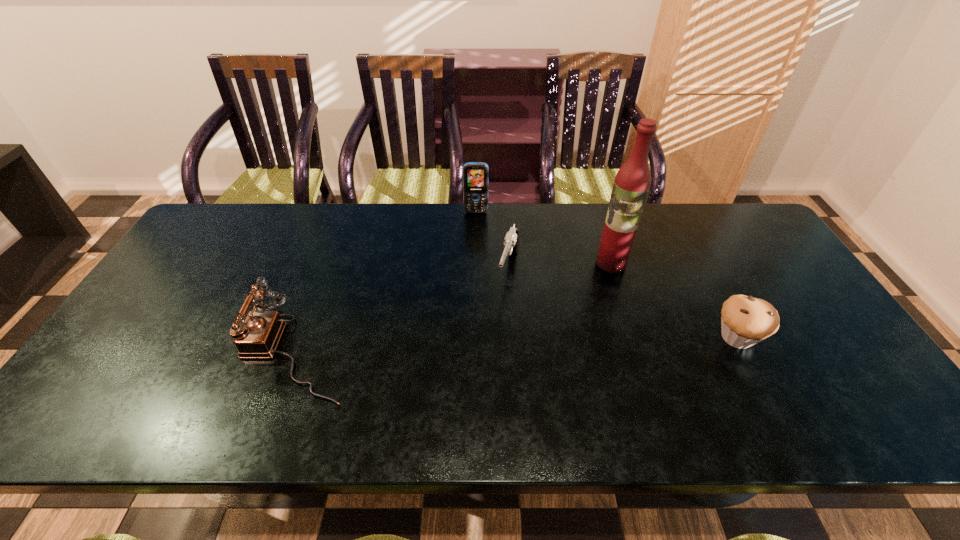
At what (x,y) coordinates should I click in order to perform the action: click on the leftmost object. Please return your answer as a coordinate pair (x, y). The height and width of the screenshot is (540, 960). Looking at the image, I should click on (257, 337).

This screenshot has width=960, height=540. Find the location of `muffin`. muffin is located at coordinates (745, 321).

What are the coordinates of `the second object from right to left` in the screenshot? It's located at (632, 182).

This screenshot has width=960, height=540. I want to click on the tallest object, so click(x=632, y=182).

At what (x,y) coordinates should I click in order to perform the action: click on the fourth shortest object. Please return your answer as a coordinate pair (x, y). This screenshot has height=540, width=960. Looking at the image, I should click on (475, 174).

Where is `the fourth object from right to left`? the fourth object from right to left is located at coordinates (475, 174).

Locate an element on the screen. This screenshot has height=540, width=960. the third object from right to left is located at coordinates (511, 241).

Identify the location of free spot located on the dial of the telephone. The height and width of the screenshot is (540, 960). (175, 351).

Where is `free space located 0.110m on the dial of the telephone`? The image size is (960, 540). free space located 0.110m on the dial of the telephone is located at coordinates (187, 351).

I want to click on blank space located on the dial of the telephone, so click(x=204, y=351).